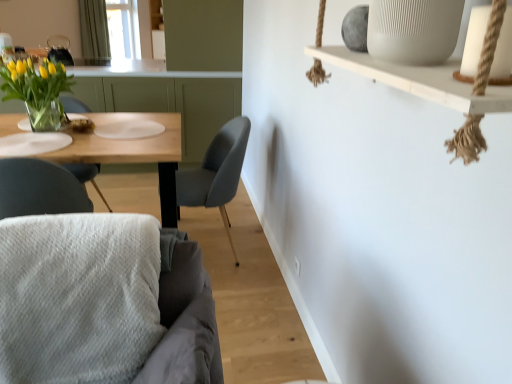
Question: Is green fabric curtain at upper left facing towards translucent glass vase with yellow tulips at left?

Choices:
 (A) yes
 (B) no

Answer: (B)

Question: Is green fabric curtain at upper left turned away from translucent glass vase with yellow tulips at left?

Choices:
 (A) no
 (B) yes

Answer: (A)

Question: Does green fabric curtain at upper left come in front of translucent glass vase with yellow tulips at left?

Choices:
 (A) yes
 (B) no

Answer: (B)

Question: Does green fabric curtain at upper left have a lesser width compared to translucent glass vase with yellow tulips at left?

Choices:
 (A) no
 (B) yes

Answer: (B)

Question: Is green fabric curtain at upper left placed right next to translucent glass vase with yellow tulips at left?

Choices:
 (A) no
 (B) yes

Answer: (A)

Question: In terms of height, does green fabric curtain at upper left look taller or shorter compared to matte gray chair at center, the second chair positioned from the front?

Choices:
 (A) short
 (B) tall

Answer: (B)

Question: Considering the positions of green fabric curtain at upper left and matte gray chair at center, the second chair positioned from the front, in the image, is green fabric curtain at upper left wider or thinner than matte gray chair at center, the second chair positioned from the front,?

Choices:
 (A) wide
 (B) thin

Answer: (B)

Question: Visually, is green fabric curtain at upper left positioned to the left or to the right of matte gray chair at center, the second chair positioned from the front?

Choices:
 (A) right
 (B) left

Answer: (B)

Question: Is green fabric curtain at upper left inside or outside of matte gray chair at center, the second chair positioned from the front?

Choices:
 (A) outside
 (B) inside

Answer: (A)

Question: Is matte gray chair at center, the second chair positioned from the front, bigger or smaller than green fabric curtain at upper left?

Choices:
 (A) big
 (B) small

Answer: (A)

Question: Would you say matte gray chair at center, the first chair viewed from the back, is to the left or to the right of green fabric curtain at upper left in the picture?

Choices:
 (A) right
 (B) left

Answer: (A)

Question: In terms of height, does matte gray chair at center, the first chair viewed from the back, look taller or shorter compared to green fabric curtain at upper left?

Choices:
 (A) short
 (B) tall

Answer: (A)

Question: From the image's perspective, is matte gray chair at center, the second chair positioned from the front, positioned above or below green fabric curtain at upper left?

Choices:
 (A) above
 (B) below

Answer: (B)

Question: Relative to white textured cushion at lower left, arranged as the second chair when viewed from the back, is green fabric curtain at upper left in front or behind?

Choices:
 (A) behind
 (B) front

Answer: (A)

Question: From a real-world perspective, is green fabric curtain at upper left positioned above or below white textured cushion at lower left, arranged as the second chair when viewed from the back?

Choices:
 (A) above
 (B) below

Answer: (A)